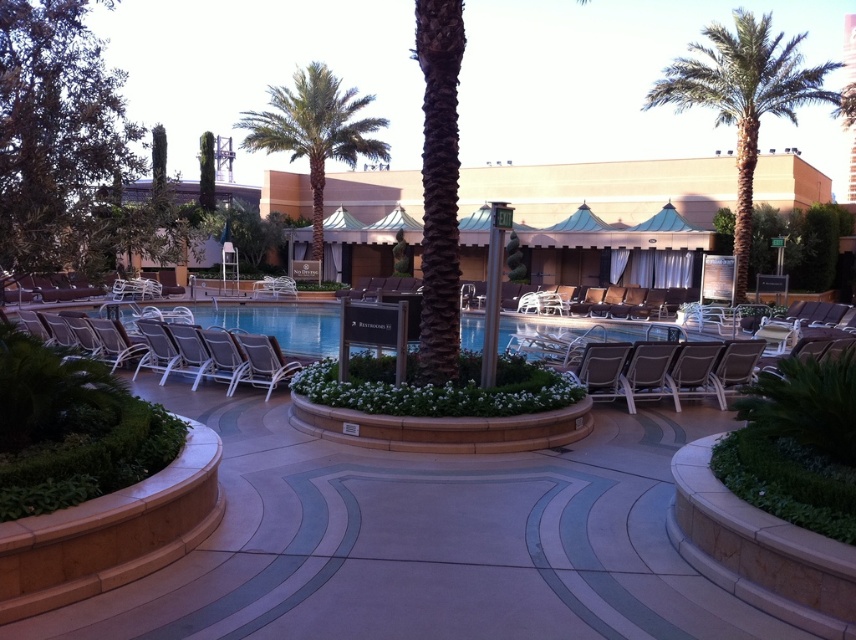
Question: Does metallic silver lounge chair at right have a lesser width compared to metallic silver lounge chair at center?

Choices:
 (A) no
 (B) yes

Answer: (B)

Question: Which point is closer to the camera taking this photo?

Choices:
 (A) (676, 392)
 (B) (292, 369)

Answer: (A)

Question: Does gray fabric beach chair at center have a lesser width compared to metallic silver lounge chair at center?

Choices:
 (A) no
 (B) yes

Answer: (B)

Question: Among these objects, which one is farthest from the camera?

Choices:
 (A) gray fabric beach chair at center
 (B) green leafy palm tree at upper right
 (C) metallic silver lounge chair at right
 (D) metallic silver lounge chair at center

Answer: (B)

Question: Which object is farther from the camera taking this photo?

Choices:
 (A) gray fabric beach chair at center
 (B) beige concrete resort at center
 (C) metallic silver lounge chair at right

Answer: (B)

Question: Is beige concrete resort at center smaller than metallic silver lounge chair at right?

Choices:
 (A) yes
 (B) no

Answer: (B)